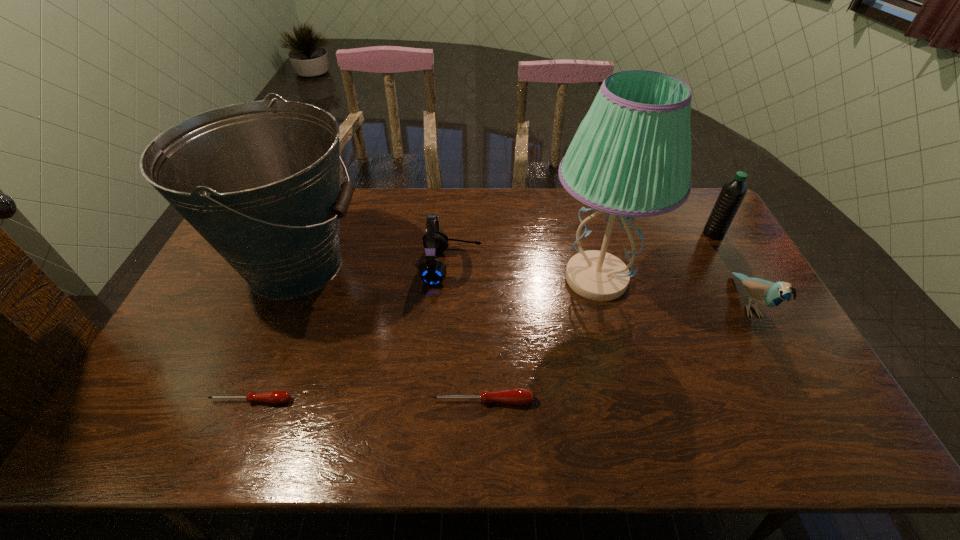
Identify the location of free space in the image that satisfies the following two spatial constraints: 1. on the back side of the tallest object; 2. on the left side of the water bottle. The width and height of the screenshot is (960, 540). click(x=585, y=234).

This screenshot has height=540, width=960. I want to click on vacant space that satisfies the following two spatial constraints: 1. with the handle on opposite sides of the bucket; 2. on the right side of the right screwdriver, so click(239, 401).

Where is `free space that satisfies the following two spatial constraints: 1. with the handle on opposite sides of the bucket; 2. on the right side of the lamp`? This screenshot has height=540, width=960. free space that satisfies the following two spatial constraints: 1. with the handle on opposite sides of the bucket; 2. on the right side of the lamp is located at coordinates (290, 279).

Where is `free space that satisfies the following two spatial constraints: 1. with the handle on opposite sides of the lamp; 2. on the left side of the bucket`? This screenshot has width=960, height=540. free space that satisfies the following two spatial constraints: 1. with the handle on opposite sides of the lamp; 2. on the left side of the bucket is located at coordinates (290, 279).

You are a GUI agent. You are given a task and a screenshot of the screen. Output one action in this format:
    pyautogui.click(x=<x>, y=<y>)
    Task: Click on the vacant space that satisfies the following two spatial constraints: 1. on the ear cushions of the headset; 2. on the left side of the tallest object
    
    Given the screenshot: What is the action you would take?
    pyautogui.click(x=451, y=279)